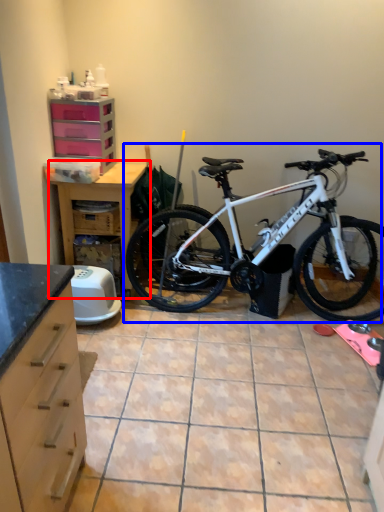
Question: Which of the following is the farthest to the observer, table (highlighted by a red box) or bicycle (highlighted by a blue box)?

Choices:
 (A) table
 (B) bicycle

Answer: (A)